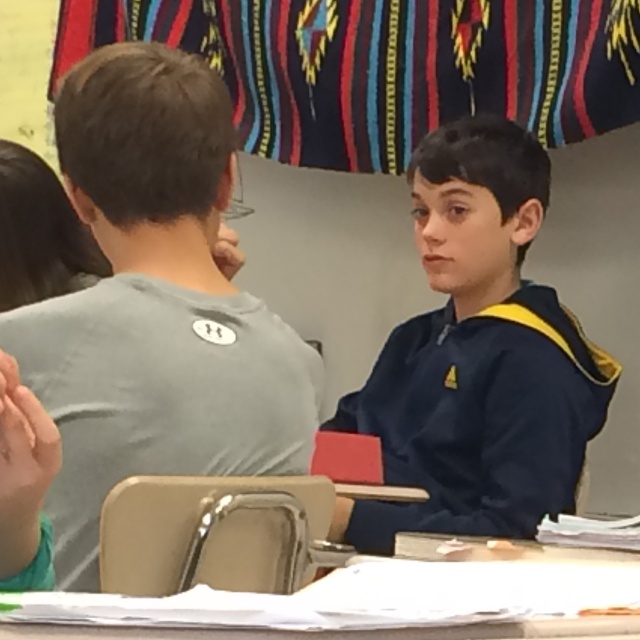
Does navy blue hoodie at center appear on the right side of white plastic table at lower center?

Indeed, navy blue hoodie at center is positioned on the right side of white plastic table at lower center.

Can you confirm if navy blue hoodie at center is wider than white plastic table at lower center?

Correct, the width of navy blue hoodie at center exceeds that of white plastic table at lower center.

In order to click on navy blue hoodie at center in this screenshot , I will do `click(477, 356)`.